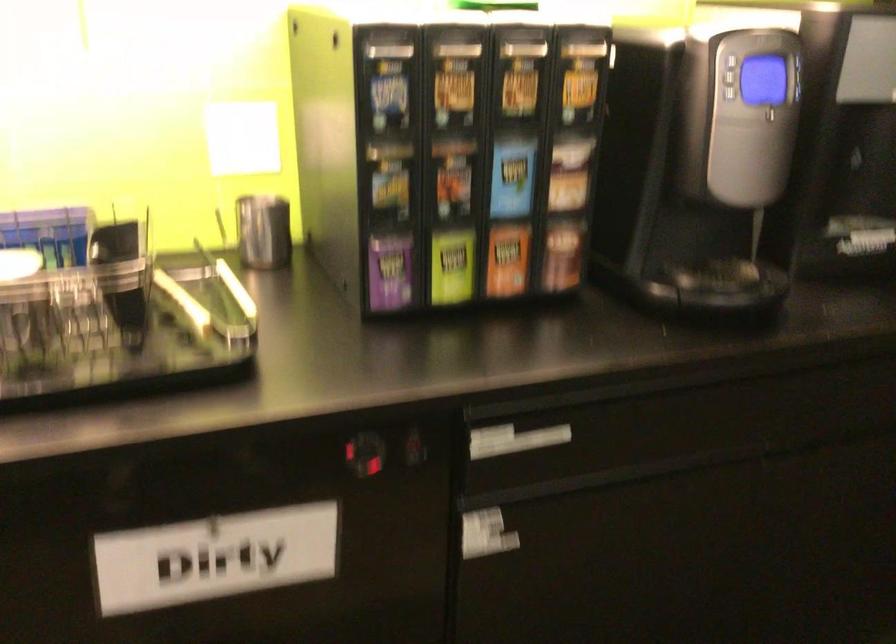
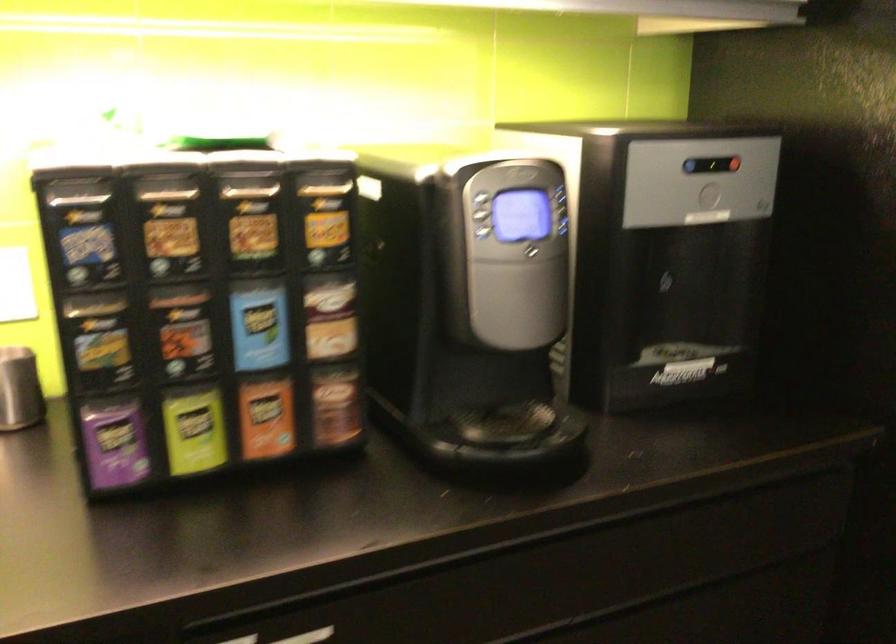
Where in the second image is the point corresponding to point 385,270 from the first image?

(114, 442)